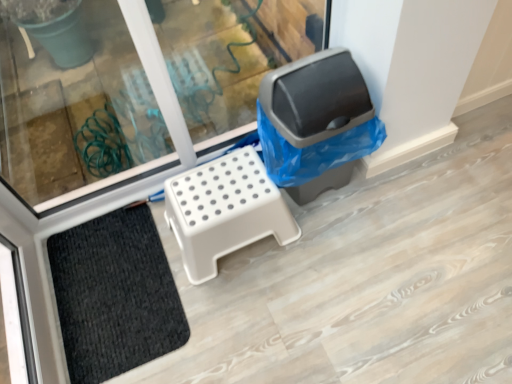
Identify the location of vacant region below black textured mat at lower left (from a real-world perspective). (111, 279).